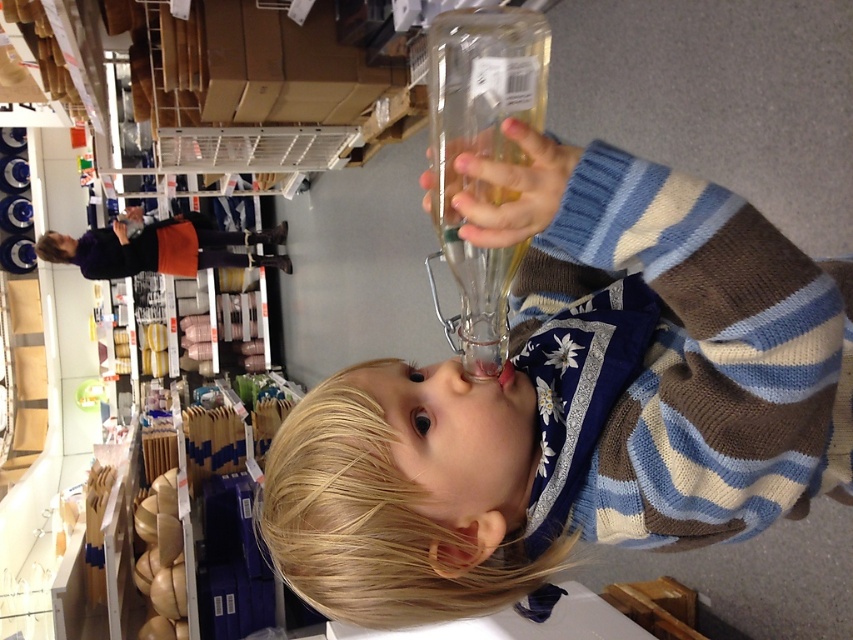
You are a store employee who needs to ensure that the clear glass bottle at center doesn not tip over when placed on a shelf. Considering the height of the matte purple sweater at upper left, which is taller, would the bottle be stable?

The clear glass bottle at center is not as tall as the matte purple sweater at upper left. Since the bottle is shorter, it may have a lower center of gravity and thus be more stable on the shelf compared to the taller sweater. However, stability also depends on the bottle base width and liquid content, which are not specified here.

Looking at this image, you are a parent in a store looking for your child. You see the clear glass bottle at center and the matte purple sweater at upper left. Which object is closer to your right side?

The clear glass bottle at center is to the right of matte purple sweater at upper left, so it is closer to your right side.

You are a store employee who needs to restock items. The clear glass bottle at center needs to be returned to its original shelf near the matte purple sweater at upper left. Given that the store requires items to be placed within 10 feet of their original spot to be considered properly restocked, can you confirm if the bottle is within the required distance?

The clear glass bottle at center is 13.93 feet from matte purple sweater at upper left, which exceeds the 10 feet requirement. Therefore, the bottle is not within the required distance for proper restocking.